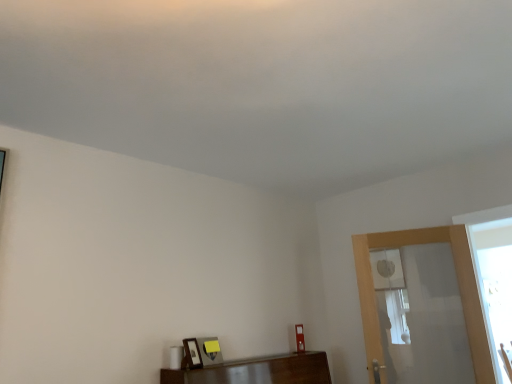
Question: Can you confirm if wooden picture frame at lower center is wider than clear glass screen door at right?

Choices:
 (A) no
 (B) yes

Answer: (A)

Question: From the image's perspective, is wooden picture frame at lower center located beneath clear glass screen door at right?

Choices:
 (A) yes
 (B) no

Answer: (A)

Question: From a real-world perspective, is wooden picture frame at lower center beneath clear glass screen door at right?

Choices:
 (A) no
 (B) yes

Answer: (B)

Question: Is wooden picture frame at lower center not near clear glass screen door at right?

Choices:
 (A) yes
 (B) no

Answer: (A)

Question: Is the depth of wooden picture frame at lower center greater than that of clear glass screen door at right?

Choices:
 (A) yes
 (B) no

Answer: (B)

Question: Does wooden picture frame at lower center appear on the left side of clear glass screen door at right?

Choices:
 (A) no
 (B) yes

Answer: (B)

Question: Does clear glass screen door at right have a lesser height compared to wooden picture frame at lower center?

Choices:
 (A) yes
 (B) no

Answer: (B)

Question: Considering the relative sizes of clear glass screen door at right and wooden picture frame at lower center in the image provided, is clear glass screen door at right smaller than wooden picture frame at lower center?

Choices:
 (A) yes
 (B) no

Answer: (B)

Question: Can you confirm if clear glass screen door at right is positioned to the right of wooden picture frame at lower center?

Choices:
 (A) no
 (B) yes

Answer: (B)

Question: Is clear glass screen door at right facing away from wooden picture frame at lower center?

Choices:
 (A) no
 (B) yes

Answer: (A)

Question: Does clear glass screen door at right have a greater height compared to wooden picture frame at lower center?

Choices:
 (A) no
 (B) yes

Answer: (B)

Question: Considering the relative positions of clear glass screen door at right and wooden picture frame at lower center in the image provided, is clear glass screen door at right in front of wooden picture frame at lower center?

Choices:
 (A) yes
 (B) no

Answer: (B)

Question: Considering their positions, is wooden picture frame at lower center located in front of or behind clear glass screen door at right?

Choices:
 (A) behind
 (B) front

Answer: (B)